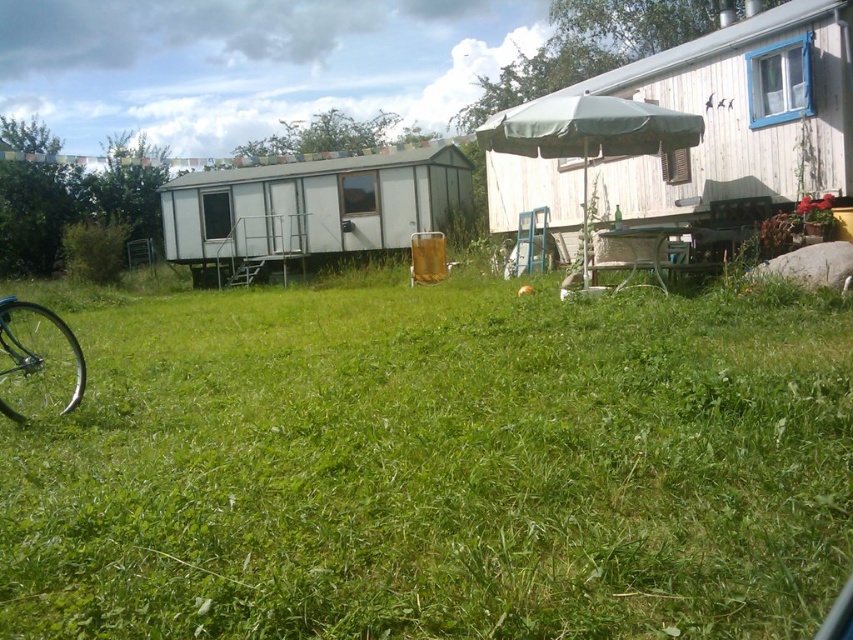
You are standing in the grassy area between two mobile homes and want to walk towards the point labeled as point (9, 340). Which direction should you move relative to point (398, 172)?

You should move away from point (398, 172) towards point (9, 340) since point (398, 172) is closer to you than point (9, 340).

Based on the photo, you are planning to place a small potted plant in the scene. Considering the green grassy at center and the shiny silver bicycle wheel at lower left, which location would allow the plant to have more space to grow horizontally?

The shiny silver bicycle wheel at lower left has a greater width than the green grassy at center, so placing the plant there would provide more horizontal space for growth.